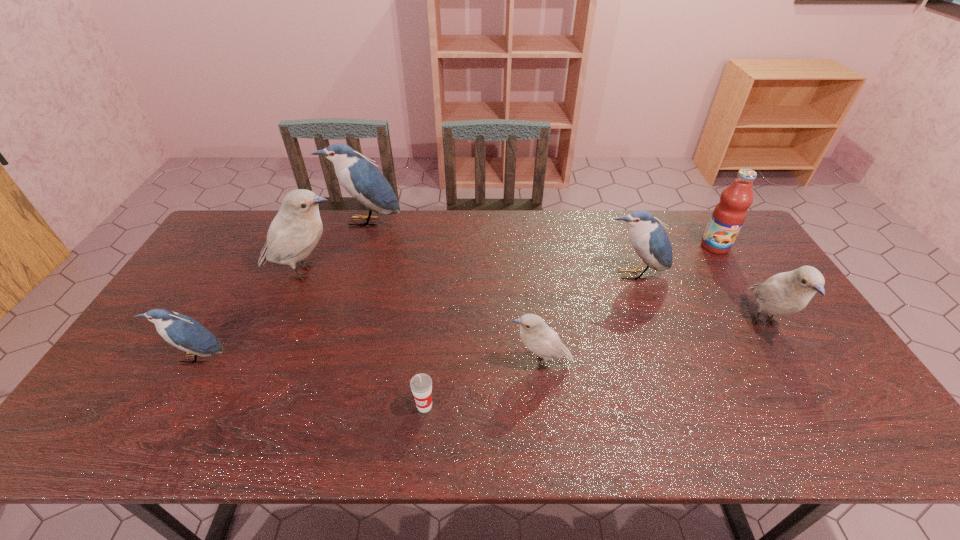
Image resolution: width=960 pixels, height=540 pixels. In order to click on free spot located 0.360m at the beak of the fourth bird from left to right in this screenshot , I will do `click(370, 362)`.

This screenshot has width=960, height=540. I want to click on vacant space located 0.290m at the beak of the fourth bird from left to right, so click(x=396, y=362).

Where is `vacant space situated 0.370m at the beak of the fourth bird from left to right`? vacant space situated 0.370m at the beak of the fourth bird from left to right is located at coordinates (366, 362).

The height and width of the screenshot is (540, 960). Identify the location of vacant space located at the tip of the smallest blue bird's beak. (163, 414).

You are a GUI agent. You are given a task and a screenshot of the screen. Output one action in this format:
    pyautogui.click(x=<x>, y=<y>)
    Task: Click on the vacant space located 0.050m on the side of the red cup with the logo
    This screenshot has width=960, height=540.
    Given the screenshot: What is the action you would take?
    pyautogui.click(x=421, y=436)

Where is `bird located at the far edge`? The image size is (960, 540). bird located at the far edge is located at coordinates (359, 176).

In order to click on fruit juice at the far edge in this screenshot , I will do `click(728, 216)`.

Where is `object located at the near edge`? object located at the near edge is located at coordinates (421, 384).

At what (x,y) coordinates should I click in order to perform the action: click on object present at the left edge. Please return your answer as a coordinate pair (x, y). Looking at the image, I should click on (181, 331).

The image size is (960, 540). Find the location of `fruit juice at the right edge`. fruit juice at the right edge is located at coordinates (728, 216).